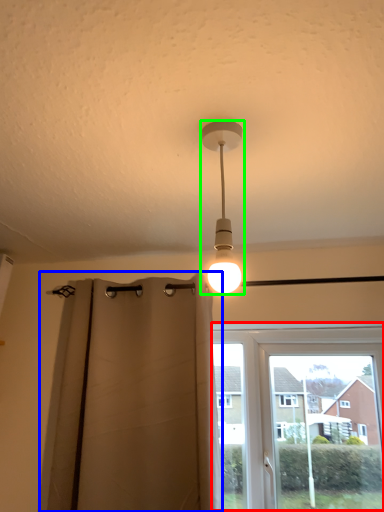
Question: Which is farther away from window (highlighted by a red box)? curtain (highlighted by a blue box) or lamp (highlighted by a green box)?

Choices:
 (A) curtain
 (B) lamp

Answer: (B)